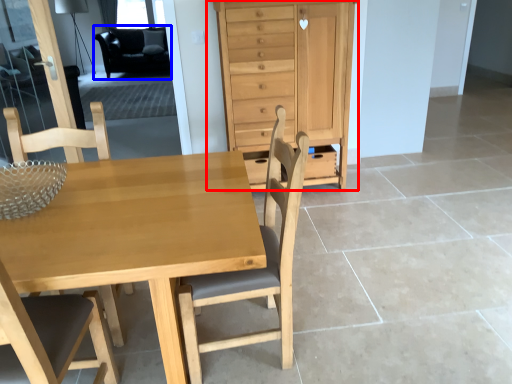
Question: Which point is closer to the camera, chest of drawers (highlighted by a red box) or armchair (highlighted by a blue box)?

Choices:
 (A) chest of drawers
 (B) armchair

Answer: (A)